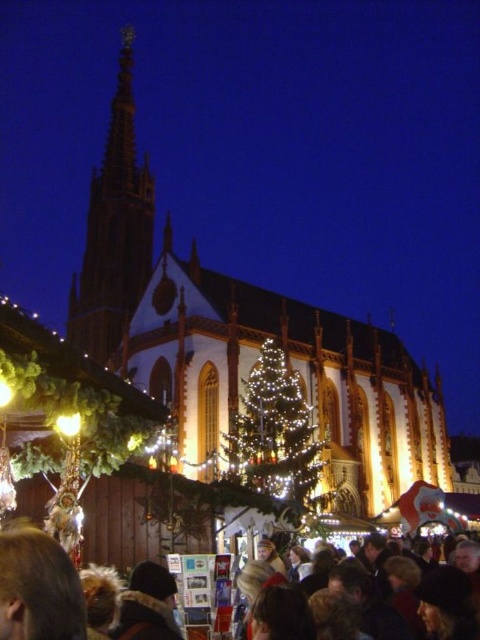
Does fur-lined coat at lower center come in front of dark brown hair at lower center?

Yes.

Is point (82, 611) less distant than point (417, 595)?

Yes, it is.

Does point (35, 548) come in front of point (474, 564)?

Yes.

I want to click on fur-lined coat at lower center, so click(37, 586).

How much distance is there between white stone church at center and fur-lined coat at lower center?

The distance of white stone church at center from fur-lined coat at lower center is 49.40 meters.

Which is behind, point (272, 307) or point (78, 604)?

Positioned behind is point (272, 307).

Where is `white stone church at center`? The height and width of the screenshot is (640, 480). white stone church at center is located at coordinates (242, 344).

Is white stone church at center wider than shiny gold spire at upper left?

Yes.

Describe the element at coordinates (242, 344) in the screenshot. I see `white stone church at center` at that location.

Who is more distant from viewer, (182, 294) or (130, 193)?

The point (130, 193) is behind.

What are the coordinates of `white stone church at center` in the screenshot? It's located at (242, 344).